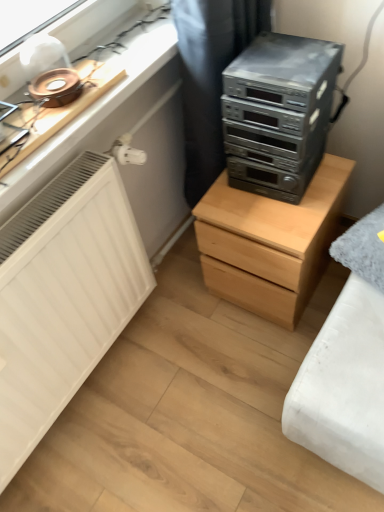
The width and height of the screenshot is (384, 512). Find the location of `free space above light wood chest of drawers at center (from a real-world perspective)`. free space above light wood chest of drawers at center (from a real-world perspective) is located at coordinates (269, 202).